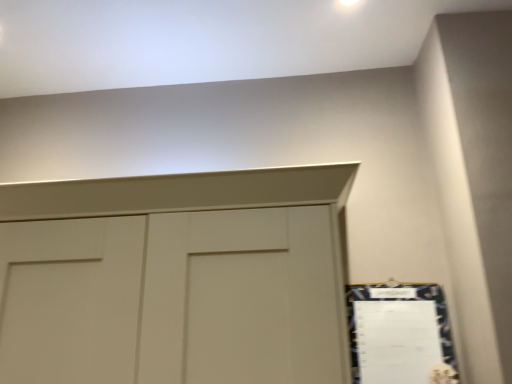
Measure the distance between white fabric bulletin board at right and camera.

white fabric bulletin board at right and camera are 1.22 meters apart.

Find the location of a particular element. The width and height of the screenshot is (512, 384). white fabric bulletin board at right is located at coordinates (400, 334).

What do you see at coordinates (400, 334) in the screenshot? I see `white fabric bulletin board at right` at bounding box center [400, 334].

Image resolution: width=512 pixels, height=384 pixels. What are the coordinates of `white fabric bulletin board at right` in the screenshot? It's located at (400, 334).